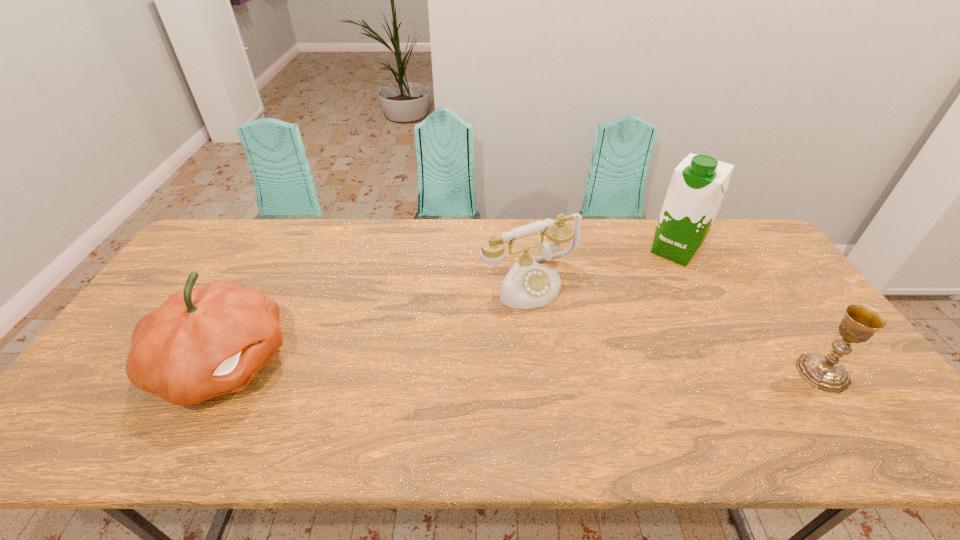
This screenshot has height=540, width=960. I want to click on free spot between the leftmost object and the rightmost object, so click(523, 368).

The width and height of the screenshot is (960, 540). Find the location of `vacant area that lies between the tallest object and the telephone`. vacant area that lies between the tallest object and the telephone is located at coordinates (602, 267).

The image size is (960, 540). What are the coordinates of `free area in between the leftmost object and the telephone` in the screenshot? It's located at (376, 323).

Find the location of a particular element. empty location between the rightmost object and the second object from right to left is located at coordinates (749, 312).

I want to click on free point between the third object from right to left and the second object from right to left, so click(602, 267).

Identify the location of free spot between the third object from left to right and the pumpkin. (449, 307).

You are a GUI agent. You are given a task and a screenshot of the screen. Output one action in this format:
    pyautogui.click(x=<x>, y=<y>)
    Task: Click on the vacant space that is in between the telephone and the second object from right to left
    
    Given the screenshot: What is the action you would take?
    pyautogui.click(x=602, y=267)

Locate an element on the screen. The width and height of the screenshot is (960, 540). vacant point located between the tallest object and the chalice is located at coordinates (749, 312).

Select which object appears as the third closest to the chalice. Please provide its 2D coordinates. Your answer should be formatted as a tuple, i.e. [(x, y)], where the tuple contains the x and y coordinates of a point satisfying the conditions above.

[(202, 342)]

Identify the location of object that is the second closest to the second tallest object. (698, 185).